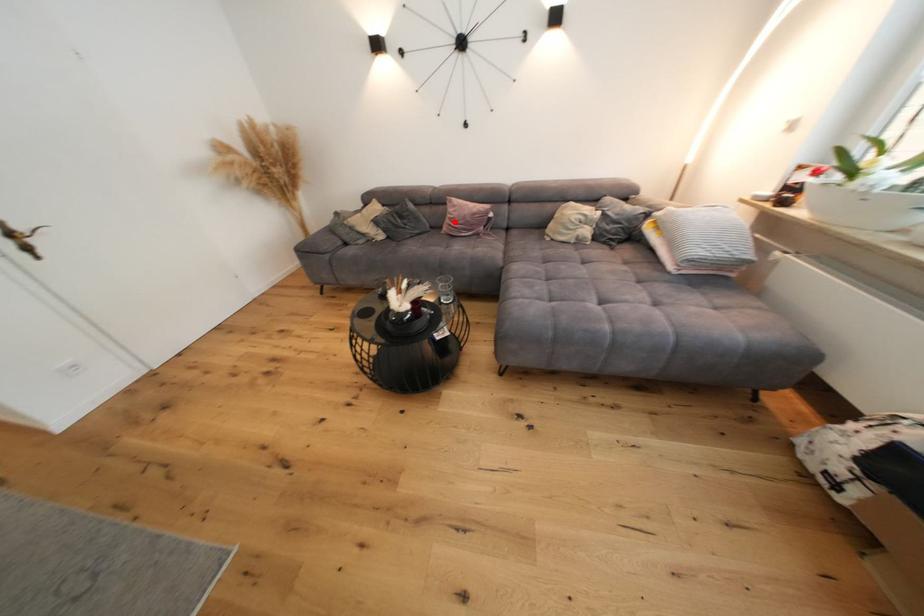
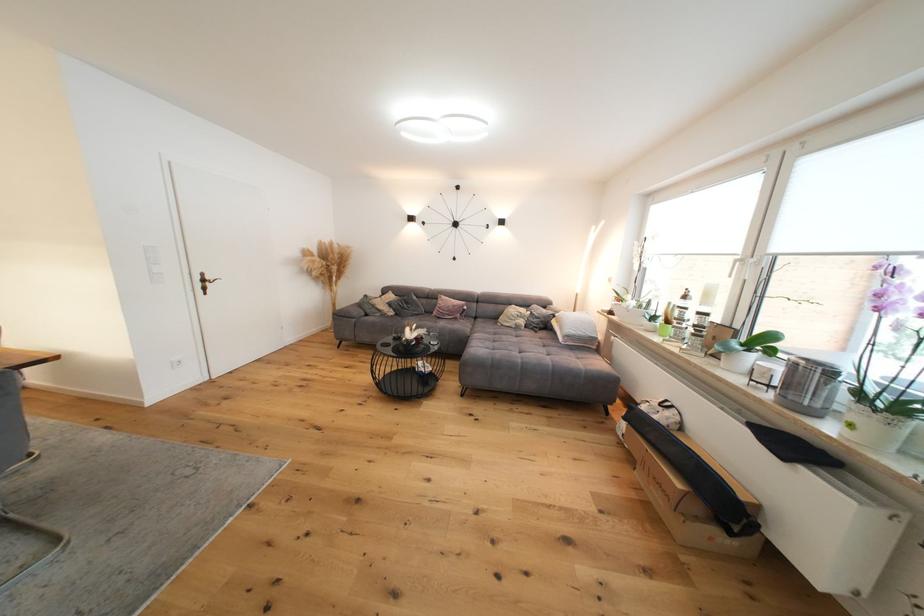
Question: I am providing you with two images of the same scene from different viewpoints. A red point is shown in image1. For the corresponding object point in image2, is it positioned nearer or farther from the camera?

Choices:
 (A) Nearer
 (B) Farther

Answer: (B)